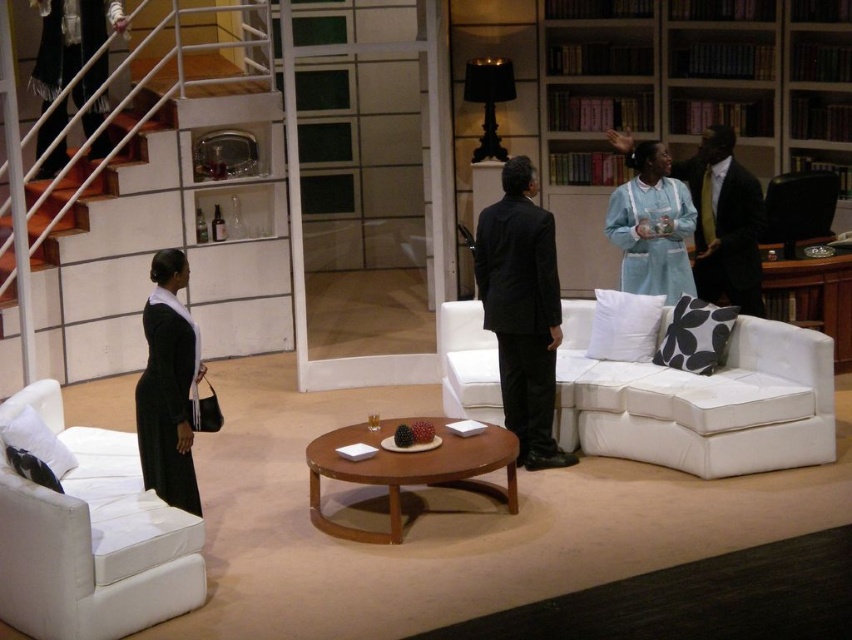
Question: Is light blue fabric bookshelf at upper right closer to the viewer compared to light blue fabric dress at upper right?

Choices:
 (A) no
 (B) yes

Answer: (A)

Question: Which is nearer to the black leather armchair at right?

Choices:
 (A) light blue fabric bookshelf at upper right
 (B) light blue fabric dress at upper right
 (C) dark blue satin business suit at right
 (D) matte black dress at left

Answer: (C)

Question: In this image, where is white fabric armchair at lower left located relative to black matte suit at center?

Choices:
 (A) left
 (B) right

Answer: (A)

Question: Which object appears closest to the camera in this image?

Choices:
 (A) matte black dress at left
 (B) white fabric armchair at lower left

Answer: (B)

Question: Which point appears closest to the camera in this image?

Choices:
 (A) (114, 609)
 (B) (755, 188)

Answer: (A)

Question: Is white fabric armchair at lower left to the right of brown wooden coffee table at center from the viewer's perspective?

Choices:
 (A) no
 (B) yes

Answer: (A)